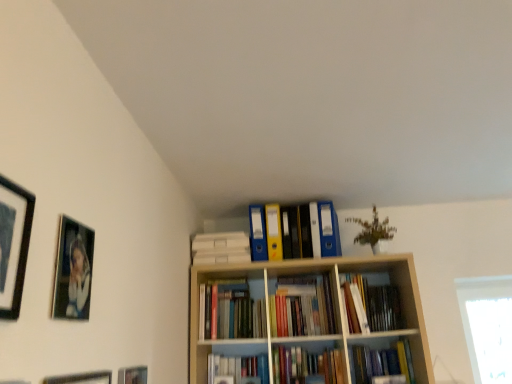
Question: From the image's perspective, is hardcover books at center, arranged as the second book when viewed from the top, over hardcover book at center, the 1th book when ordered from bottom to top?

Choices:
 (A) yes
 (B) no

Answer: (A)

Question: Is the surface of hardcover books at center, arranged as the second book when viewed from the top, in direct contact with hardcover book at center, which appears as the 3th book when viewed from the top?

Choices:
 (A) no
 (B) yes

Answer: (A)

Question: Considering the relative sizes of hardcover books at center, arranged as the second book when viewed from the top, and hardcover book at center, which appears as the 3th book when viewed from the top, in the image provided, is hardcover books at center, arranged as the second book when viewed from the top, taller than hardcover book at center, which appears as the 3th book when viewed from the top,?

Choices:
 (A) no
 (B) yes

Answer: (B)

Question: From a real-world perspective, is hardcover books at center, which is the 2th book from bottom to top, over hardcover book at center, the 1th book when ordered from bottom to top?

Choices:
 (A) yes
 (B) no

Answer: (A)

Question: Considering the relative sizes of hardcover books at center, arranged as the second book when viewed from the top, and hardcover book at center, the 1th book when ordered from bottom to top, in the image provided, is hardcover books at center, arranged as the second book when viewed from the top, bigger than hardcover book at center, the 1th book when ordered from bottom to top,?

Choices:
 (A) yes
 (B) no

Answer: (A)

Question: Which is correct: hardcover book at center, which appears as the 3th book when viewed from the top, is inside matte black picture frame at lower left, which is the 2th picture frame in bottom-to-top order, or outside of it?

Choices:
 (A) outside
 (B) inside

Answer: (A)

Question: In terms of width, does hardcover book at center, the 1th book when ordered from bottom to top, look wider or thinner when compared to matte black picture frame at lower left, which is the third picture frame in top-to-bottom order?

Choices:
 (A) wide
 (B) thin

Answer: (A)

Question: From the image's perspective, is hardcover book at center, which appears as the 3th book when viewed from the top, above or below matte black picture frame at lower left, which is the third picture frame in top-to-bottom order?

Choices:
 (A) above
 (B) below

Answer: (B)

Question: In terms of size, does hardcover book at center, the 1th book when ordered from bottom to top, appear bigger or smaller than matte black picture frame at lower left, which is the third picture frame in top-to-bottom order?

Choices:
 (A) big
 (B) small

Answer: (A)

Question: From a real-world perspective, is matte black picture frame at lower left, which is counted as the fourth picture frame, starting from the top, physically located above or below matte black picture frame at lower left, which is the 2th picture frame in bottom-to-top order?

Choices:
 (A) below
 (B) above

Answer: (A)

Question: Does point (41, 380) appear closer or farther from the camera than point (141, 372)?

Choices:
 (A) farther
 (B) closer

Answer: (B)

Question: In terms of size, does matte black picture frame at lower left, which is counted as the fourth picture frame, starting from the top, appear bigger or smaller than matte black picture frame at lower left, which is the 2th picture frame in bottom-to-top order?

Choices:
 (A) small
 (B) big

Answer: (B)

Question: Choose the correct answer: Is matte black picture frame at lower left, which is counted as the 1th picture frame, starting from the bottom, inside matte black picture frame at lower left, which is the third picture frame in top-to-bottom order, or outside it?

Choices:
 (A) inside
 (B) outside

Answer: (B)

Question: Visually, is hardcover books at center, arranged as the second book when viewed from the top, positioned to the left or to the right of matte plastic folders at upper center, the first book positioned from the top?

Choices:
 (A) left
 (B) right

Answer: (B)

Question: In terms of size, does hardcover books at center, which is the 2th book from bottom to top, appear bigger or smaller than matte plastic folders at upper center, which is counted as the 3th book, starting from the bottom?

Choices:
 (A) small
 (B) big

Answer: (B)